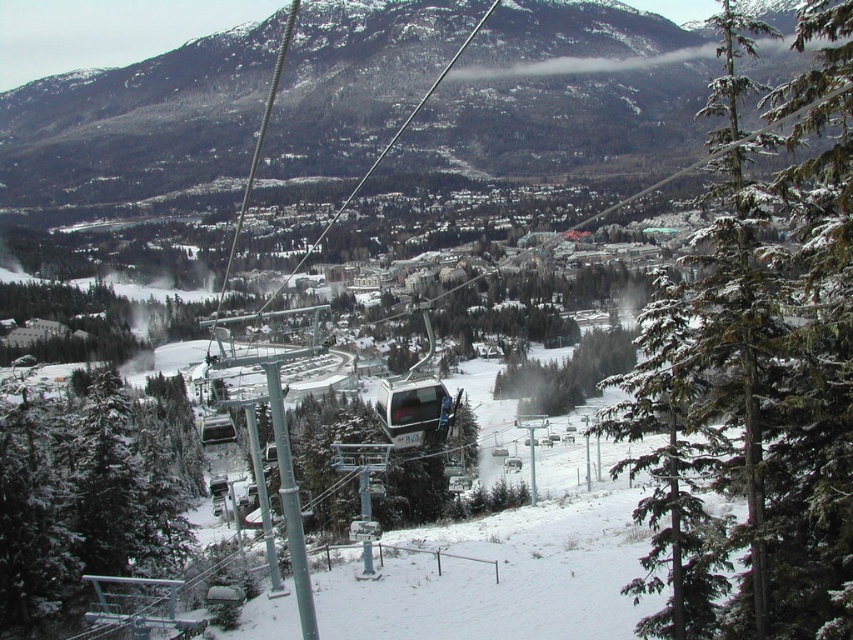
Question: Is green textured tree at center smaller than metallic silver cable car at center?

Choices:
 (A) no
 (B) yes

Answer: (A)

Question: Which of the following is the farthest from the observer?

Choices:
 (A) green textured pine tree at center right
 (B) green matte tree at lower left
 (C) metallic silver cable car at center

Answer: (B)

Question: Is green textured pine tree at center right to the right of metallic silver cable car at center from the viewer's perspective?

Choices:
 (A) no
 (B) yes

Answer: (B)

Question: Is the position of green textured pine tree at center right less distant than that of green matte tree at lower left?

Choices:
 (A) yes
 (B) no

Answer: (A)

Question: Which object appears farthest from the camera in this image?

Choices:
 (A) metallic silver cable car at center
 (B) green matte tree at lower left

Answer: (B)

Question: Among these points, which one is farthest from the camera?

Choices:
 (A) (26, 451)
 (B) (519, 408)
 (C) (451, 404)

Answer: (B)